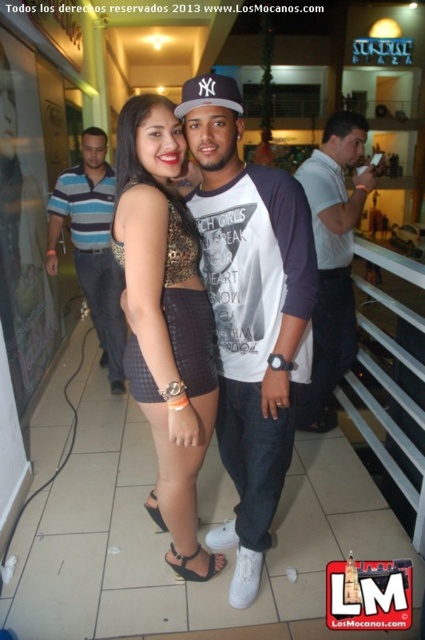
You are a photographer at a fashion event and need to decide which outfit to feature in the magazine. The leopard print dress at center and the striped polo shirt at left are both candidates. Based on their lengths, which one would you recommend for a model who prefers shorter hemlines?

The leopard print dress at center is shorter than the striped polo shirt at left, so it would be the better choice for a model preferring shorter hemlines.

You are a photographer at the event and need to adjust the lighting to ensure both the leopard print dress at center and the white cotton shirt at center are well lit. Based on their positions, which clothing item is closer to the floor and might need additional lighting from below?

The leopard print dress at center is located below the white cotton shirt at center, so it is closer to the floor and may require additional lighting from below to ensure proper illumination.